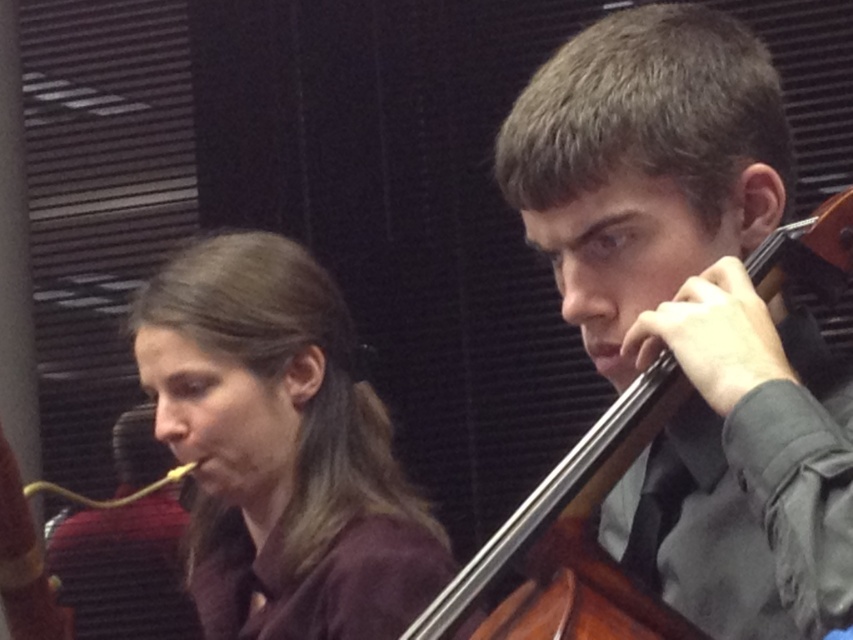
Image resolution: width=853 pixels, height=640 pixels. What are the coordinates of `brown matte hair at center` in the screenshot? It's located at (281, 449).

Which is more to the left, brown matte hair at center or brown wooden cello at center?

brown matte hair at center is more to the left.

The image size is (853, 640). I want to click on brown matte hair at center, so click(x=281, y=449).